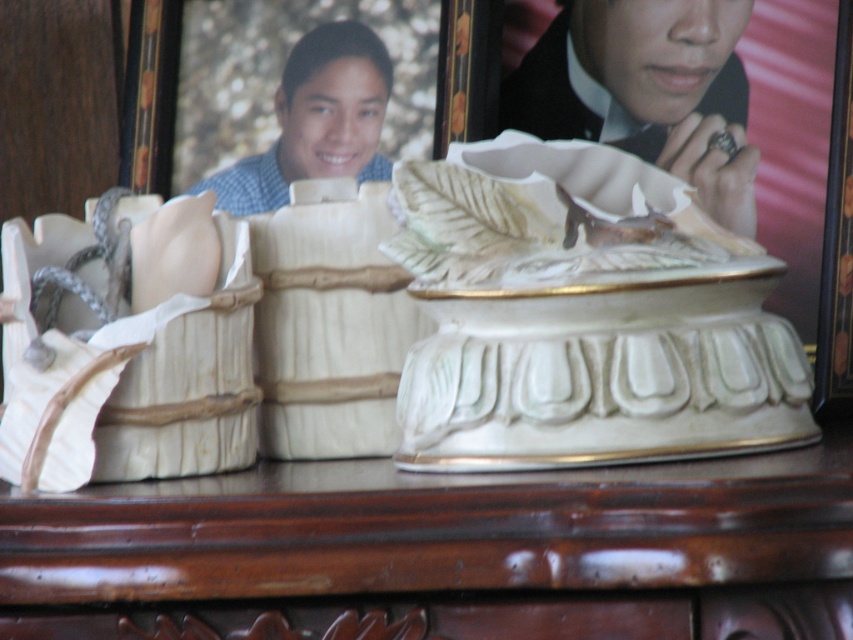
You are organizing a display and need to ensure that the matte black ring at upper right and the blue checkered shirt at upper center are spaced appropriately. Based on their sizes, which object requires more horizontal space for placement?

The matte black ring at upper right requires more horizontal space because its width is larger than the blue checkered shirt at upper center.

You are organizing a display and need to know which item is shorter between the porcelain leaf at center and the blue checkered shirt at upper center. Can you determine this?

The porcelain leaf at center has a lesser height compared to the blue checkered shirt at upper center, so the porcelain leaf at center is shorter.